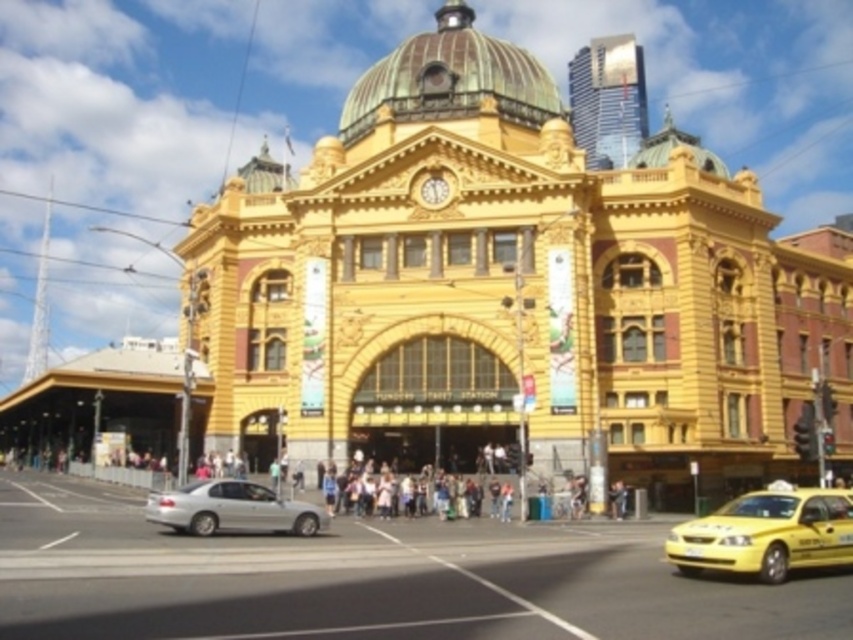
Which is in front, point (680, 532) or point (189, 483)?

Point (680, 532) is more forward.

Is yellow matte taxi at lower right smaller than satin silver sedan at lower left?

Actually, yellow matte taxi at lower right might be larger than satin silver sedan at lower left.

Which is behind, point (688, 525) or point (234, 506)?

The point (234, 506) is more distant.

You are a GUI agent. You are given a task and a screenshot of the screen. Output one action in this format:
    pyautogui.click(x=<x>, y=<y>)
    Task: Click on the yellow matte taxi at lower right
    The height and width of the screenshot is (640, 853).
    Given the screenshot: What is the action you would take?
    pyautogui.click(x=766, y=534)

Between point (436, 582) and point (286, 509), which one is positioned behind?

Positioned behind is point (286, 509).

Is yellow metallic taxi at center smaller than satin silver sedan at lower left?

Actually, yellow metallic taxi at center might be larger than satin silver sedan at lower left.

Does point (631, 524) come farther from viewer compared to point (271, 509)?

Yes, point (631, 524) is farther from viewer.

I want to click on yellow metallic taxi at center, so click(x=369, y=579).

Is point (688, 625) positioned behind point (756, 529)?

No.

Can you confirm if yellow metallic taxi at center is thinner than yellow matte taxi at lower right?

No.

Does point (171, 621) come closer to viewer compared to point (730, 552)?

Yes, point (171, 621) is in front of point (730, 552).

Locate an element on the screen. The image size is (853, 640). yellow metallic taxi at center is located at coordinates (369, 579).